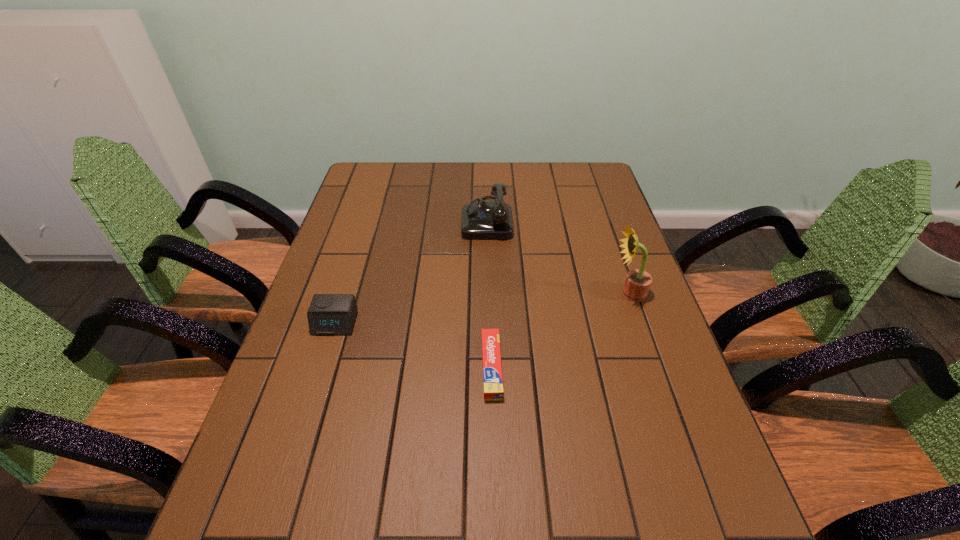
Find the location of `vacant region at the right edge of the desktop`. vacant region at the right edge of the desktop is located at coordinates (612, 208).

In the image, there is a desktop. Identify the location of free region at the far left corner. (370, 192).

Identify the location of free space between the toothpaste and the farthest object. (490, 293).

Identify the location of vacant space that's between the nearest object and the alarm clock. (414, 345).

Where is `unoccupied area between the telephone and the sunflower`? unoccupied area between the telephone and the sunflower is located at coordinates (558, 256).

This screenshot has height=540, width=960. Identify the location of vacant area that lies between the shortest object and the telephone. pyautogui.click(x=490, y=293).

This screenshot has width=960, height=540. In order to click on free space between the tallest object and the shortest object in this screenshot , I will do `click(561, 330)`.

This screenshot has height=540, width=960. Identify the location of free space between the farthest object and the tallest object. 558,256.

You are a GUI agent. You are given a task and a screenshot of the screen. Output one action in this format:
    pyautogui.click(x=<x>, y=<y>)
    Task: Click on the empty location between the leftmost object and the second farthest object
    This screenshot has width=960, height=540.
    Given the screenshot: What is the action you would take?
    pyautogui.click(x=482, y=308)

At what (x,y) coordinates should I click in order to perform the action: click on vacant point located between the telephone and the sunflower. Please return your answer as a coordinate pair (x, y). This screenshot has height=540, width=960. Looking at the image, I should click on (558, 256).